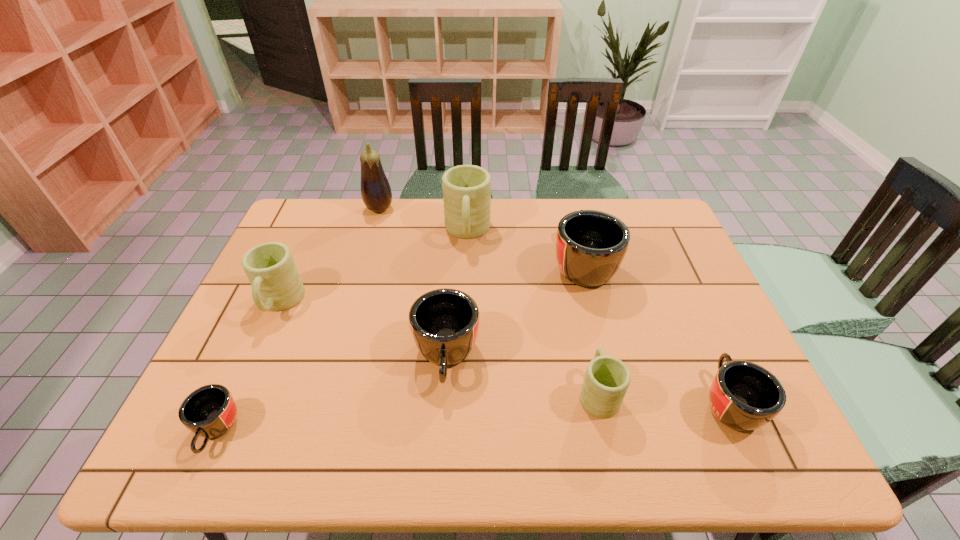
Identify the location of object that is positioned at the near left corner. (210, 411).

Identify the location of object that is at the near right corner. The height and width of the screenshot is (540, 960). (744, 396).

You are a GUI agent. You are given a task and a screenshot of the screen. Output one action in this format:
    pyautogui.click(x=<x>, y=<y>)
    Task: Click on the vacant region at the far edge of the desktop
    This screenshot has height=540, width=960.
    Given the screenshot: What is the action you would take?
    pyautogui.click(x=519, y=209)

Identify the location of vacant space at the near edge of the desktop. The width and height of the screenshot is (960, 540). (349, 435).

This screenshot has height=540, width=960. Find the location of `vacant space at the left edge of the desktop`. vacant space at the left edge of the desktop is located at coordinates (258, 414).

The width and height of the screenshot is (960, 540). I want to click on free space at the right edge, so click(x=707, y=330).

The height and width of the screenshot is (540, 960). In the image, there is a desktop. Find the location of `free region at the far left corner`. free region at the far left corner is located at coordinates (328, 213).

Identify the location of vacant space in between the rightmost red mug and the sixth object from right to left. (554, 306).

This screenshot has height=540, width=960. In order to click on free space between the rightmost red mug and the smallest red mug in this screenshot , I will do `click(472, 416)`.

Image resolution: width=960 pixels, height=540 pixels. What are the coordinates of `free space between the shortest mug and the nearest green mug` in the screenshot? It's located at (407, 411).